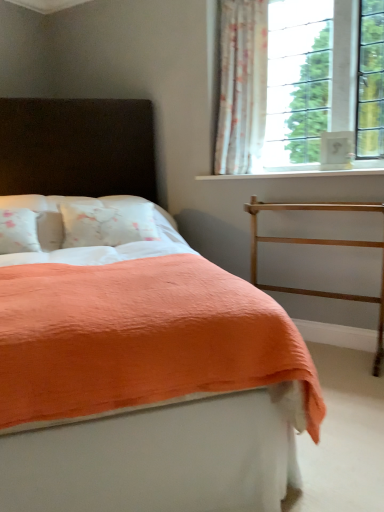
Question: From the image's perspective, relative to gold metallic balustrade at right, is white smooth window sill at upper right above or below?

Choices:
 (A) above
 (B) below

Answer: (A)

Question: In terms of height, does white smooth window sill at upper right look taller or shorter compared to gold metallic balustrade at right?

Choices:
 (A) short
 (B) tall

Answer: (A)

Question: Which object is positioned closest to the coral fabric bed at center?

Choices:
 (A) gold metallic balustrade at right
 (B) white floral fabric curtain at upper right
 (C) white smooth window sill at upper right

Answer: (A)

Question: Which object is positioned closest to the white floral fabric curtain at upper right?

Choices:
 (A) gold metallic balustrade at right
 (B) coral fabric bed at center
 (C) white smooth window sill at upper right

Answer: (C)